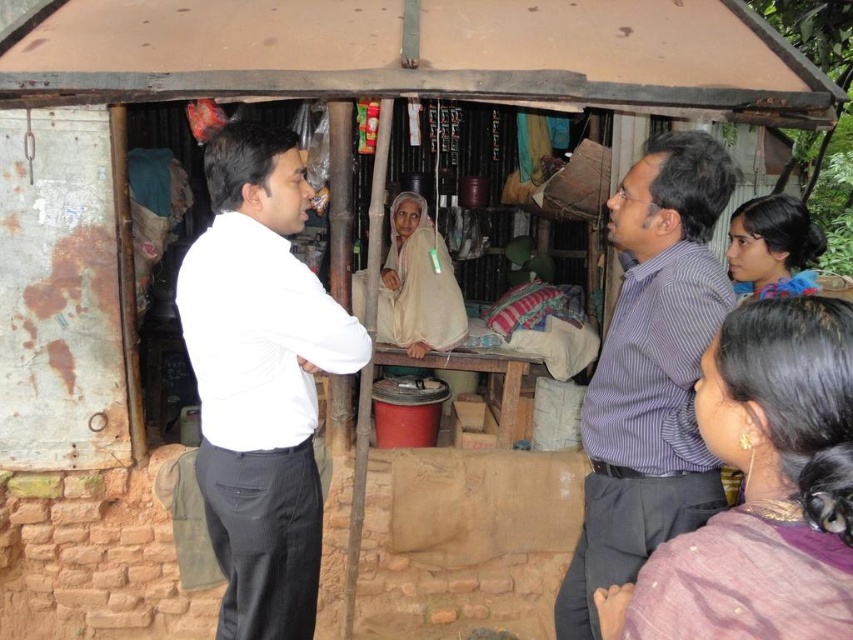
Question: Can you confirm if white smooth shirt at left is positioned to the left of striped cotton shirt at center?

Choices:
 (A) no
 (B) yes

Answer: (B)

Question: Does white smooth shirt at left appear on the right side of striped cotton shirt at center?

Choices:
 (A) no
 (B) yes

Answer: (A)

Question: Which object is closer to the camera taking this photo?

Choices:
 (A) striped cotton shirt at center
 (B) white smooth shirt at left

Answer: (A)

Question: Is the position of white smooth shirt at left less distant than that of striped cotton shirt at center?

Choices:
 (A) no
 (B) yes

Answer: (A)